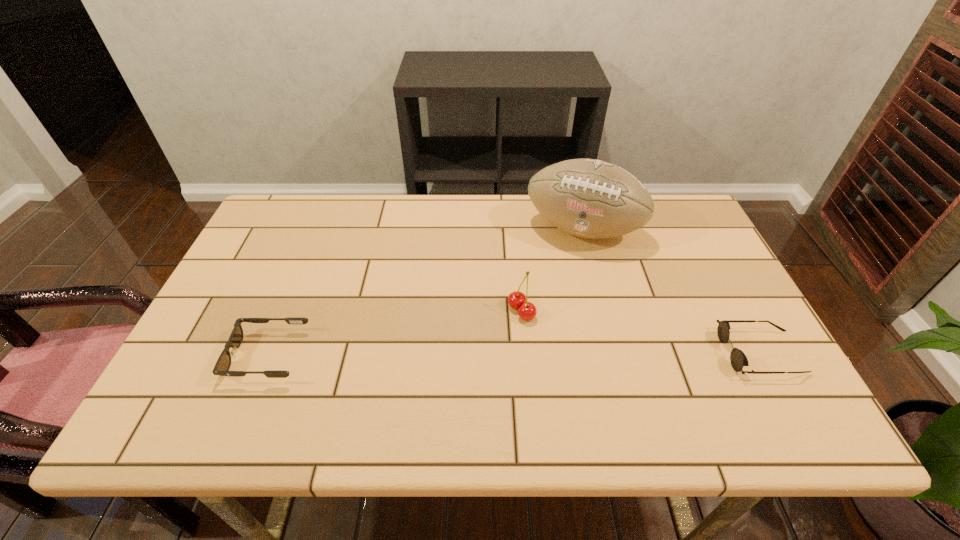
You are a GUI agent. You are given a task and a screenshot of the screen. Output one action in this format:
    pyautogui.click(x=<x>, y=<y>)
    Task: Click on the vacant space situated on the front-facing side of the rightmost object
    The height and width of the screenshot is (540, 960).
    Given the screenshot: What is the action you would take?
    pyautogui.click(x=599, y=353)

Find the location of `free point located 0.290m on the laces of the tallest object`. free point located 0.290m on the laces of the tallest object is located at coordinates (547, 329).

The width and height of the screenshot is (960, 540). I want to click on vacant space located on the laces of the tallest object, so click(564, 272).

Locate an element on the screen. The image size is (960, 540). free space located 0.300m on the laces of the tallest object is located at coordinates (546, 332).

The height and width of the screenshot is (540, 960). I want to click on vacant space located 0.180m with the stems of the third shortest object pointing upwards, so click(449, 353).

Locate an element on the screen. The image size is (960, 540). vacant space located 0.230m with the stems of the third shortest object pointing upwards is located at coordinates (430, 363).

Locate an element on the screen. Image resolution: width=960 pixels, height=540 pixels. free space located with the stems of the third shortest object pointing upwards is located at coordinates (491, 329).

The height and width of the screenshot is (540, 960). Identify the location of object located in the far edge section of the desktop. (588, 198).

I want to click on object at the left edge, so click(222, 366).

Identify the location of object present at the right edge. The image size is (960, 540). (738, 359).